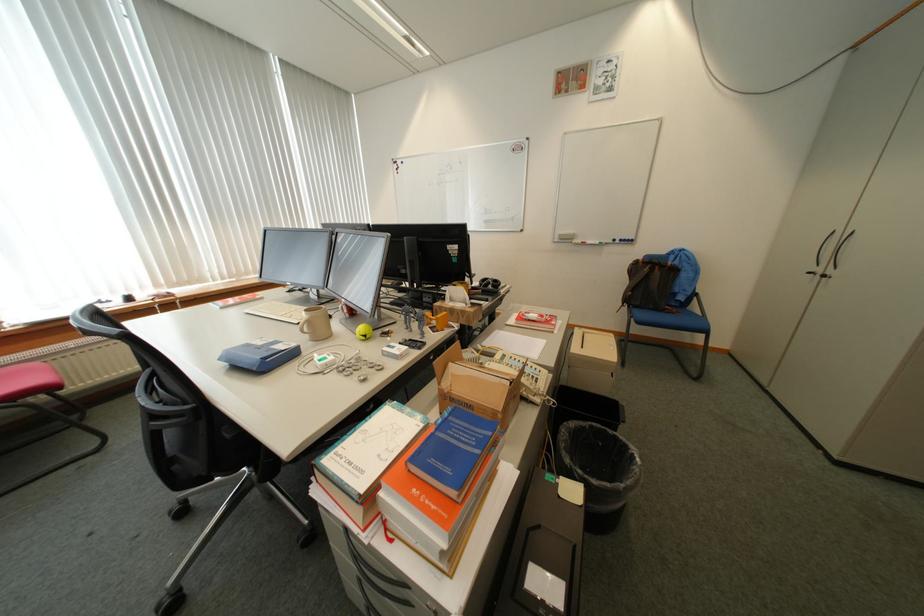
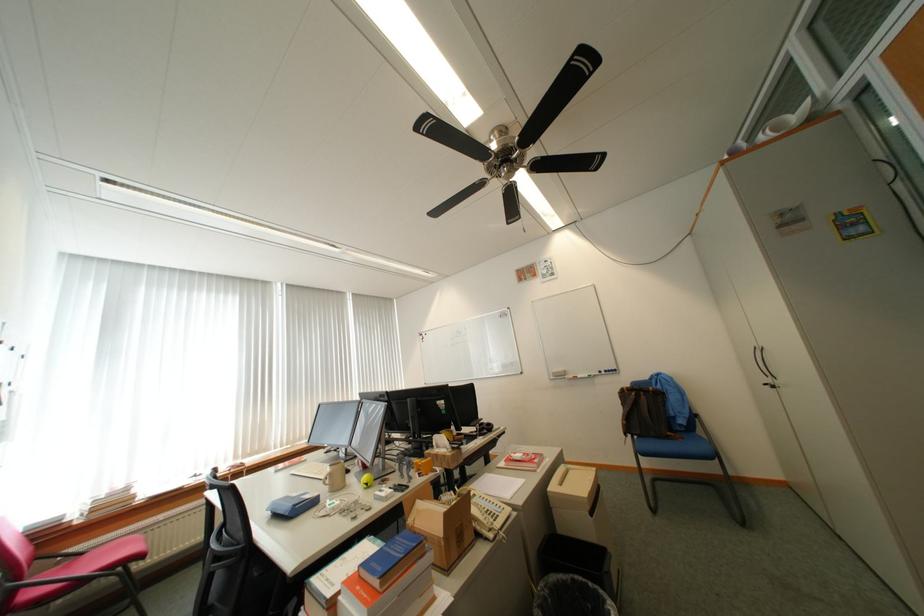
Locate, in the second image, the point that corresponds to [638,309] in the first image.

(641, 438)